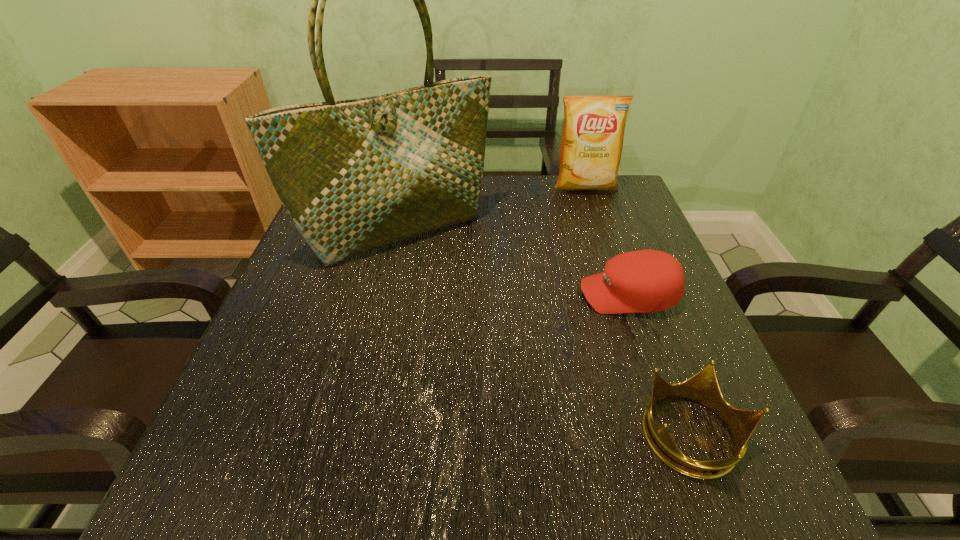
You are a GUI agent. You are given a task and a screenshot of the screen. Output one action in this format:
    pyautogui.click(x=<x>, y=<y>)
    Task: Click on the object positioned at the far right corner
    
    Given the screenshot: What is the action you would take?
    pyautogui.click(x=593, y=132)

Where is `object at the near right corner`? object at the near right corner is located at coordinates point(703,387).

You are a GUI agent. You are given a task and a screenshot of the screen. Output one action in this format:
    pyautogui.click(x=<x>, y=<y>)
    Task: Click on the vacant area at the far edge
    The width and height of the screenshot is (960, 540).
    Given the screenshot: What is the action you would take?
    pyautogui.click(x=540, y=194)

At what (x,y) coordinates should I click in order to perform the action: click on vacant region at the near edge of the desktop. Please return your answer as a coordinate pair (x, y). The image size is (960, 540). Looking at the image, I should click on (314, 466).

Image resolution: width=960 pixels, height=540 pixels. What are the coordinates of `vacant space at the left edge of the desktop` in the screenshot? It's located at (303, 293).

Identify the location of free location at the right edge. (690, 356).

This screenshot has width=960, height=540. In the image, there is a desktop. In order to click on vacant space at the near left corner in this screenshot , I will do `click(217, 491)`.

Locate an element on the screen. Image resolution: width=960 pixels, height=540 pixels. free space at the near right corner of the desktop is located at coordinates (759, 462).

Identify the location of vacant region between the third shortest object and the second farthest object. click(x=492, y=208).

Locate an element on the screen. The image size is (960, 540). vacant area that lies between the second nearest object and the crisp (potato chip) is located at coordinates (607, 241).